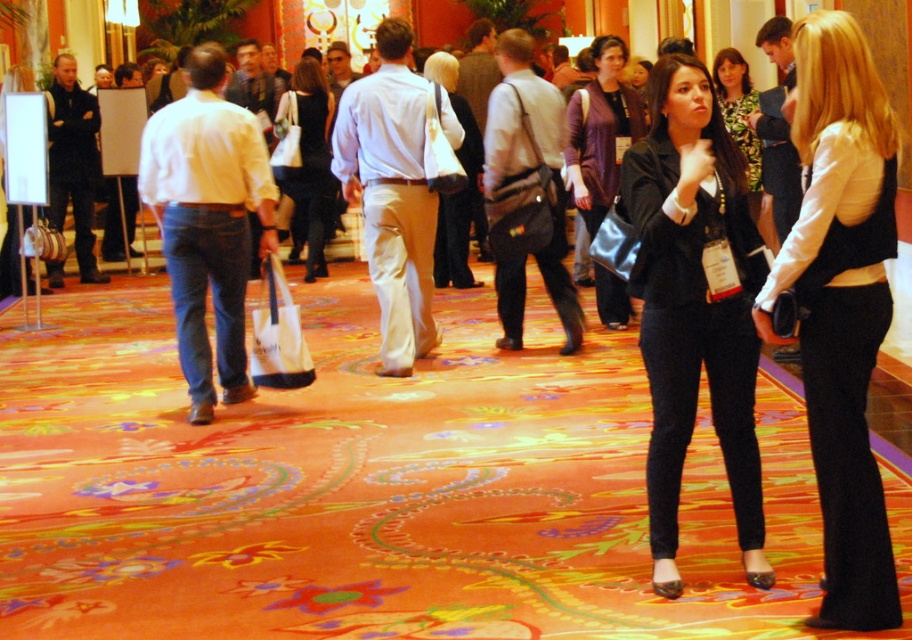
Question: Estimate the real-world distances between objects in this image. Which object is closer to the black textured blazer at center?

Choices:
 (A) purple matte cardigan at center
 (B) matte black dress at center
 (C) matte white bag at center
 (D) green floral dress at center

Answer: (D)

Question: Which is nearer to the purple matte cardigan at center?

Choices:
 (A) matte black dress at center
 (B) matte white bag at center
 (C) green floral dress at center
 (D) black textured blazer at center

Answer: (C)

Question: Can you confirm if black satin vest at center is thinner than green floral dress at center?

Choices:
 (A) no
 (B) yes

Answer: (B)

Question: Is purple matte cardigan at center above matte black dress at center?

Choices:
 (A) no
 (B) yes

Answer: (A)

Question: Observing the image, what is the correct spatial positioning of black textured blazer at center in reference to matte black dress at center?

Choices:
 (A) below
 (B) above

Answer: (A)

Question: Among these points, which one is nearest to the camera?

Choices:
 (A) click(444, 280)
 (B) click(326, 113)
 (C) click(744, 150)
 (D) click(741, 529)

Answer: (D)